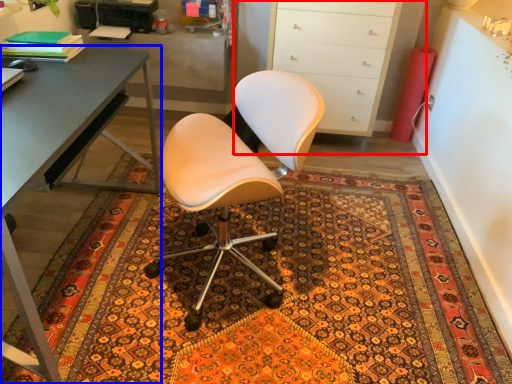
Question: Which object appears closest to the camera in this image, cabinetry (highlighted by a red box) or desk (highlighted by a blue box)?

Choices:
 (A) cabinetry
 (B) desk

Answer: (B)